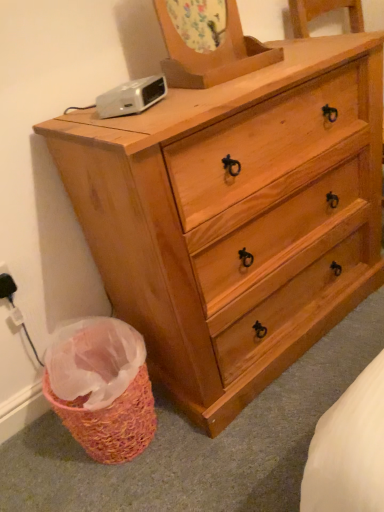
Where is `free location to the left of white plastic clock at upper left`? This screenshot has width=384, height=512. free location to the left of white plastic clock at upper left is located at coordinates (71, 120).